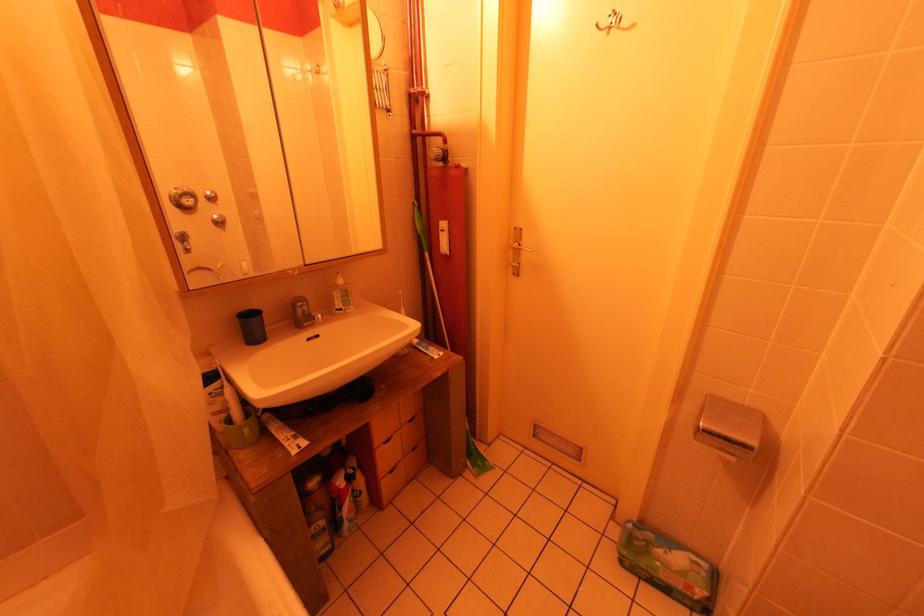
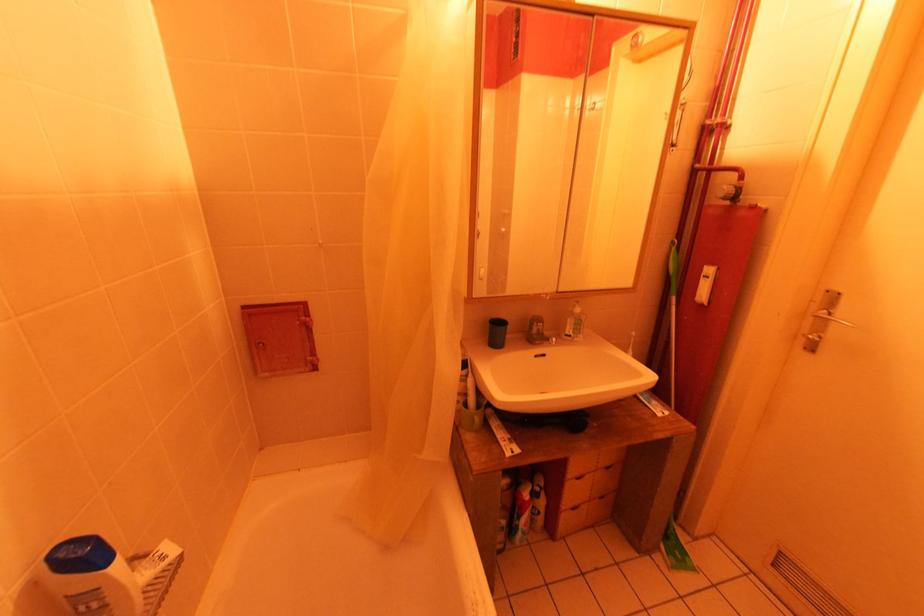
Question: The camera is either moving clockwise (left) or counter-clockwise (right) around the object. The first image is from the beginning of the video and the second image is from the end. Is the camera moving left or right when shooting the video?

Choices:
 (A) Left
 (B) Right

Answer: (B)